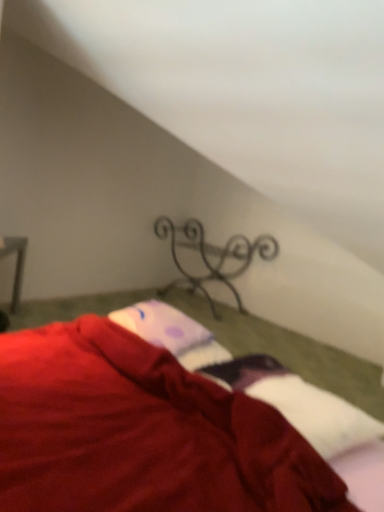
Question: Is velvet red blanket at lower center situated inside purple dotted fabric at center or outside?

Choices:
 (A) outside
 (B) inside

Answer: (A)

Question: Is point (165, 394) closer or farther from the camera than point (147, 325)?

Choices:
 (A) closer
 (B) farther

Answer: (A)

Question: Considering the real-world distances, which object is farthest from the velvet red blanket at lower center?

Choices:
 (A) purple dotted fabric at center
 (B) metallic wrought iron at center

Answer: (B)

Question: Which of these objects is positioned farthest from the velvet red blanket at lower center?

Choices:
 (A) metallic wrought iron at center
 (B) purple dotted fabric at center

Answer: (A)